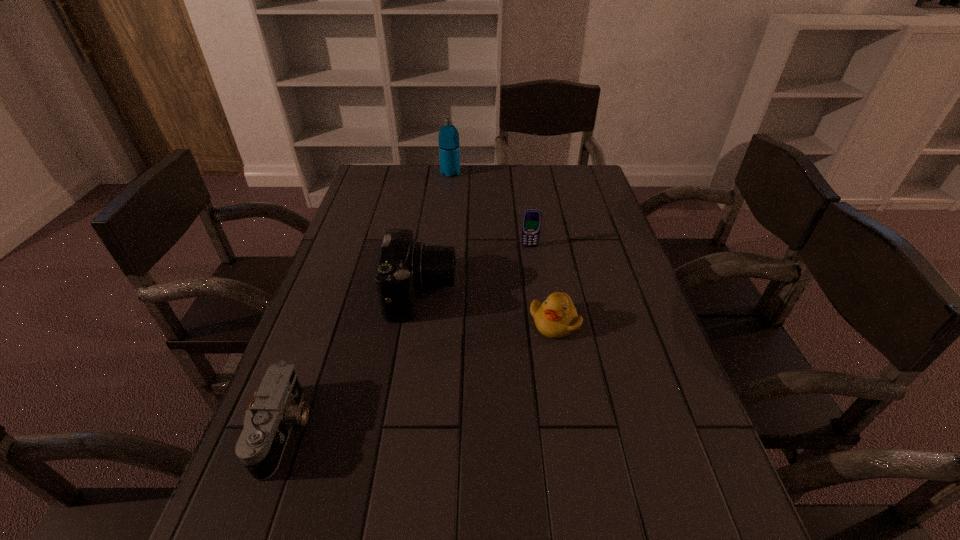
The image size is (960, 540). What are the coordinates of `free location located 0.090m on the lens of the fourth shortest object` in the screenshot? It's located at (490, 293).

Identify the location of free space located on the front-facing side of the third shortest object. This screenshot has height=540, width=960. (539, 314).

I want to click on vacant space positioned 0.060m on the beak of the duckling, so click(561, 362).

At what (x,y) coordinates should I click in order to perform the action: click on free space located on the lens of the shorter camera. Please return your answer as a coordinate pair (x, y). The width and height of the screenshot is (960, 540). Looking at the image, I should click on (498, 430).

In order to click on object that is at the far edge in this screenshot , I will do `click(449, 147)`.

Identify the location of object positioned at the left edge. This screenshot has height=540, width=960. (267, 425).

You are a GUI agent. You are given a task and a screenshot of the screen. Output one action in this format:
    pyautogui.click(x=<x>, y=<y>)
    Task: Click on the vacant space at the far edge of the desktop
    The image size is (960, 540).
    Given the screenshot: What is the action you would take?
    pyautogui.click(x=495, y=192)

In the image, there is a desktop. At what (x,y) coordinates should I click in order to perform the action: click on vacant space at the left edge. Please return your answer as a coordinate pair (x, y). This screenshot has height=540, width=960. Looking at the image, I should click on (290, 529).

Identify the location of blank space at the right edge. tap(688, 463).

I want to click on vacant space at the far left corner, so click(x=398, y=191).